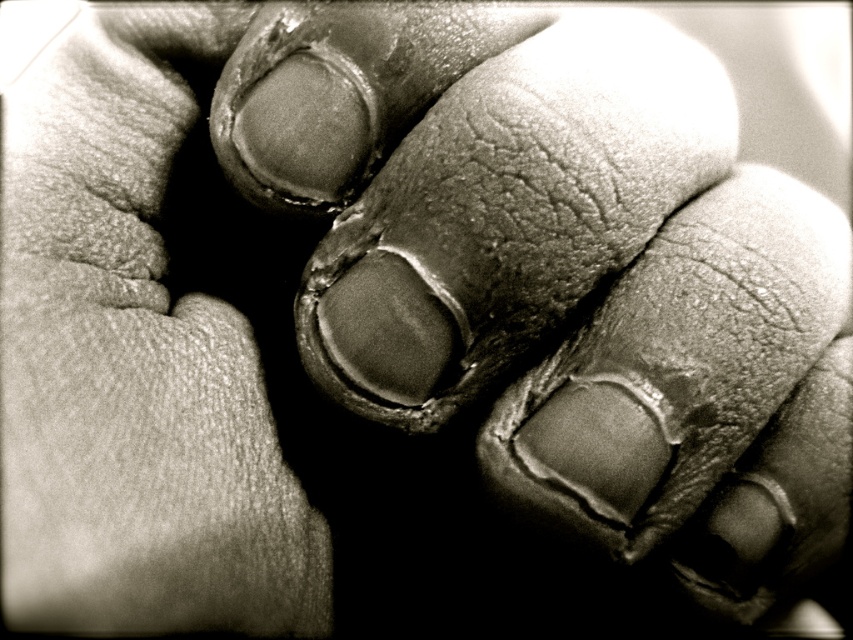
Question: Among these objects, which one is nearest to the camera?

Choices:
 (A) smooth leather hand at center
 (B) leather glove at left

Answer: (B)

Question: Does smooth leather hand at center appear on the right side of leather glove at left?

Choices:
 (A) no
 (B) yes

Answer: (B)

Question: Is smooth leather hand at center in front of leather glove at left?

Choices:
 (A) no
 (B) yes

Answer: (A)

Question: Among these objects, which one is farthest from the camera?

Choices:
 (A) leather glove at left
 (B) smooth leather hand at center

Answer: (B)

Question: Does smooth leather hand at center have a smaller size compared to leather glove at left?

Choices:
 (A) no
 (B) yes

Answer: (B)

Question: Which point appears farthest from the camera in this image?

Choices:
 (A) (598, 90)
 (B) (16, 486)

Answer: (A)